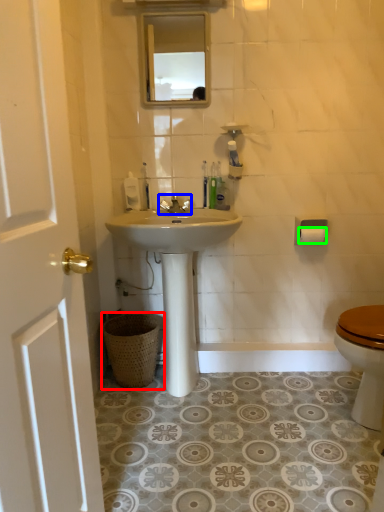
Question: Which object is the farthest from trash bin/can (highlighted by a red box)? Choose among these: faucet (highlighted by a blue box) or toilet paper (highlighted by a green box).

Choices:
 (A) faucet
 (B) toilet paper

Answer: (B)